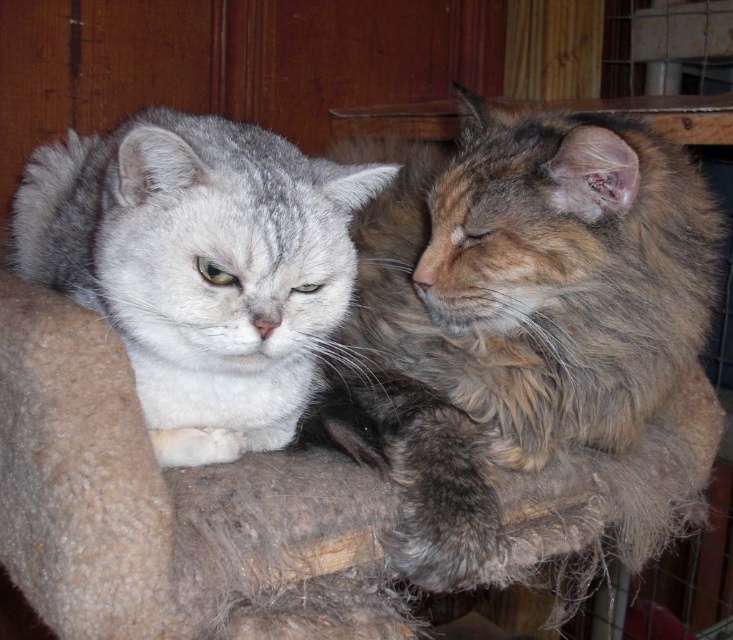
Question: Can you confirm if fluffy brown cat at right is bigger than gray fur cat at left?

Choices:
 (A) no
 (B) yes

Answer: (B)

Question: Observing the image, what is the correct spatial positioning of fluffy brown cat at right in reference to gray fur cat at left?

Choices:
 (A) below
 (B) above

Answer: (B)

Question: In this image, where is fluffy brown cat at right located relative to gray fur cat at left?

Choices:
 (A) left
 (B) right

Answer: (B)